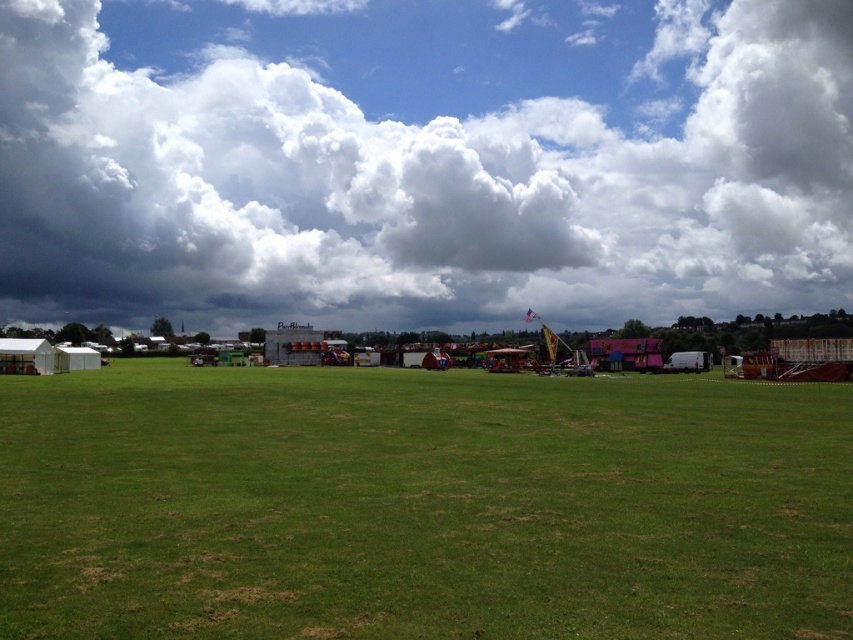
Which of these two, cloudy sky at upper center or green grassy field at center, stands taller?

cloudy sky at upper center is taller.

Is point (33, 307) farther from camera compared to point (697, 509)?

Yes, it is.

What are the coordinates of `cloudy sky at upper center` in the screenshot? It's located at (422, 161).

The width and height of the screenshot is (853, 640). I want to click on cloudy sky at upper center, so click(422, 161).